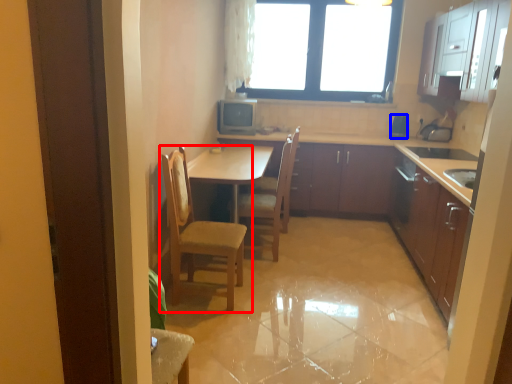
Question: Which object is further to the camera taking this photo, chair (highlighted by a red box) or appliance (highlighted by a blue box)?

Choices:
 (A) chair
 (B) appliance

Answer: (B)